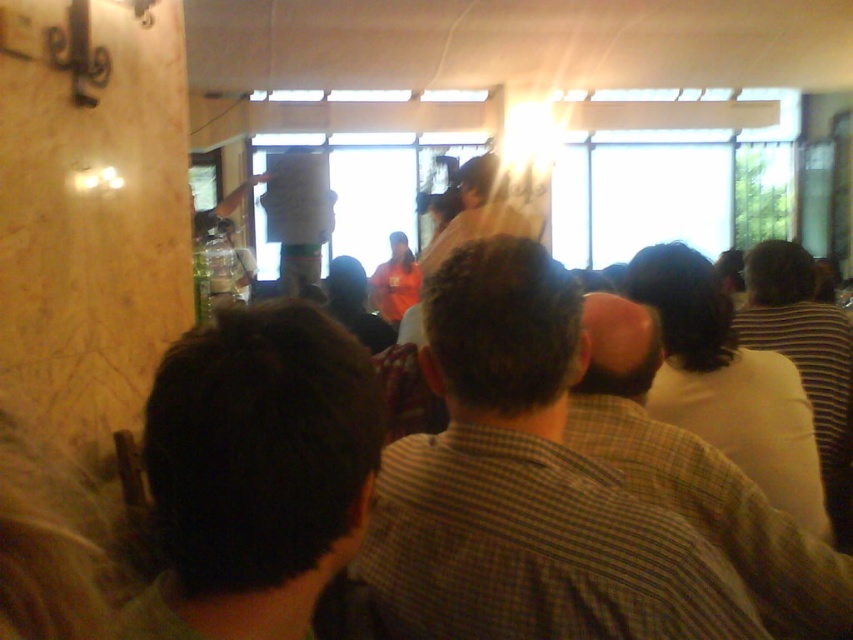
Question: Is checkered shirt at center thinner than white shirt at center?

Choices:
 (A) no
 (B) yes

Answer: (A)

Question: Among these objects, which one is farthest from the camera?

Choices:
 (A) striped shirt at right
 (B) dark brown hair at center
 (C) white shirt at center

Answer: (A)

Question: Can you confirm if white shirt at center is positioned below striped shirt at right?

Choices:
 (A) yes
 (B) no

Answer: (A)

Question: Is dark brown hair at center thinner than white shirt at center?

Choices:
 (A) yes
 (B) no

Answer: (A)

Question: Which point is closer to the camera?

Choices:
 (A) (161, 442)
 (B) (761, 579)
 (C) (606, 570)

Answer: (A)

Question: Which of the following is the farthest from the observer?

Choices:
 (A) white shirt at center
 (B) striped shirt at right
 (C) checkered shirt at center
 (D) dark brown hair at center

Answer: (B)